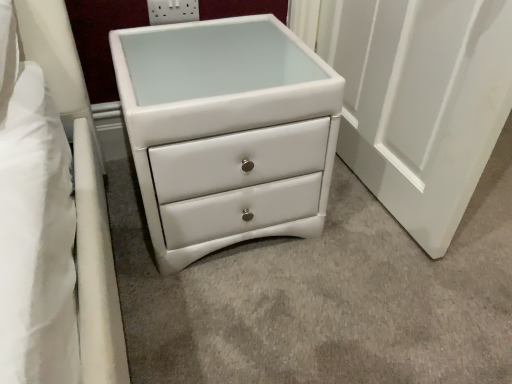
Question: Considering the positions of point (287, 188) and point (150, 4), is point (287, 188) closer or farther from the camera than point (150, 4)?

Choices:
 (A) farther
 (B) closer

Answer: (B)

Question: Considering the positions of white leather chest of drawers at center and white plastic socket at upper center in the image, is white leather chest of drawers at center wider or thinner than white plastic socket at upper center?

Choices:
 (A) thin
 (B) wide

Answer: (B)

Question: From their relative heights in the image, would you say white leather chest of drawers at center is taller or shorter than white plastic socket at upper center?

Choices:
 (A) tall
 (B) short

Answer: (A)

Question: Is point (181, 0) positioned closer to the camera than point (189, 213)?

Choices:
 (A) farther
 (B) closer

Answer: (A)

Question: Is white plastic socket at upper center spatially inside white leather chest of drawers at center, or outside of it?

Choices:
 (A) outside
 (B) inside

Answer: (A)

Question: From a real-world perspective, is white plastic socket at upper center physically located above or below white leather chest of drawers at center?

Choices:
 (A) below
 (B) above

Answer: (B)

Question: Is white plastic socket at upper center taller or shorter than white leather chest of drawers at center?

Choices:
 (A) tall
 (B) short

Answer: (B)